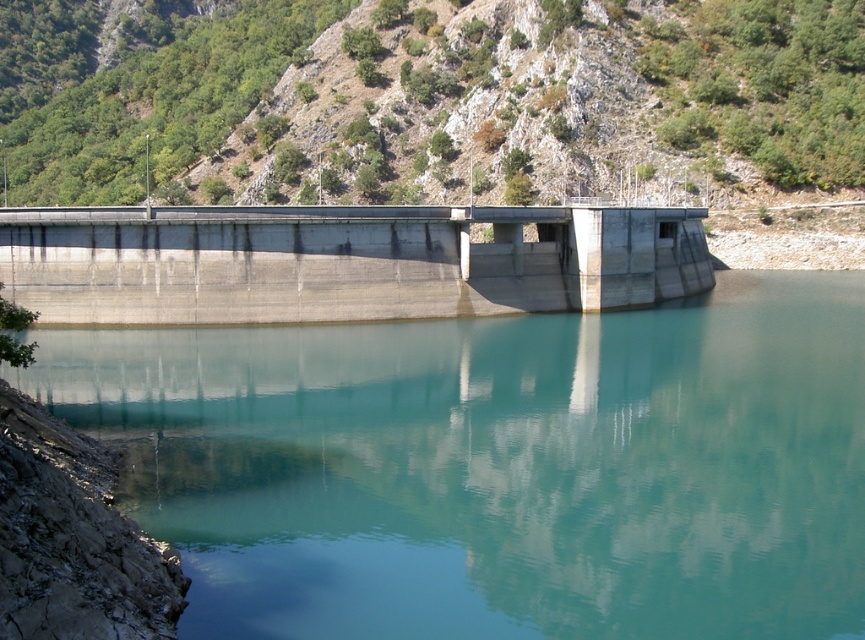
You are an engineer inspecting the dam and need to compare the widths of the green textured hillside at upper center and the gray concrete dam at center. Which one is wider?

The green textured hillside at upper center is wider than the gray concrete dam at center according to the description.

You are standing on the dam and looking at two points on the dam surface. The first point is at coordinates point (46, 108) and the second point is at point (146, 253). Which point is closer to you?

Point (46, 108) is further to the camera than point (146, 253), so the closer point is point (146, 253).